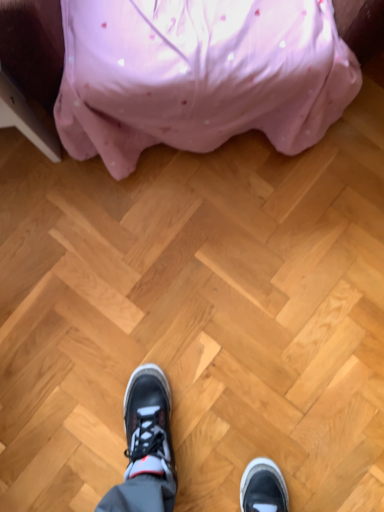
This screenshot has height=512, width=384. What do you see at coordinates (198, 75) in the screenshot?
I see `pink satin blanket at upper center` at bounding box center [198, 75].

The image size is (384, 512). Identify the location of pink satin blanket at upper center. (198, 75).

At what (x,y) coordinates should I click in order to perform the action: click on pink satin blanket at upper center. Please return your answer as a coordinate pair (x, y). Image resolution: width=384 pixels, height=512 pixels. Looking at the image, I should click on coord(198,75).